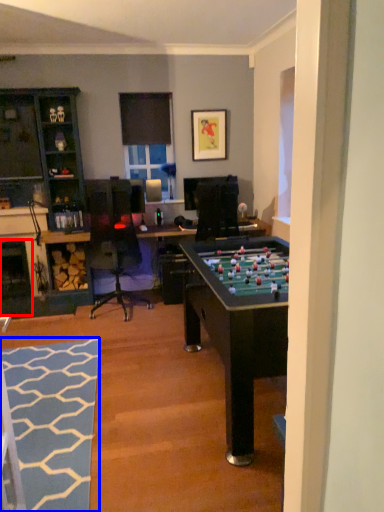
Question: Which object appears farthest to the camera in this image, fireplace (highlighted by a red box) or flat (highlighted by a blue box)?

Choices:
 (A) fireplace
 (B) flat

Answer: (A)